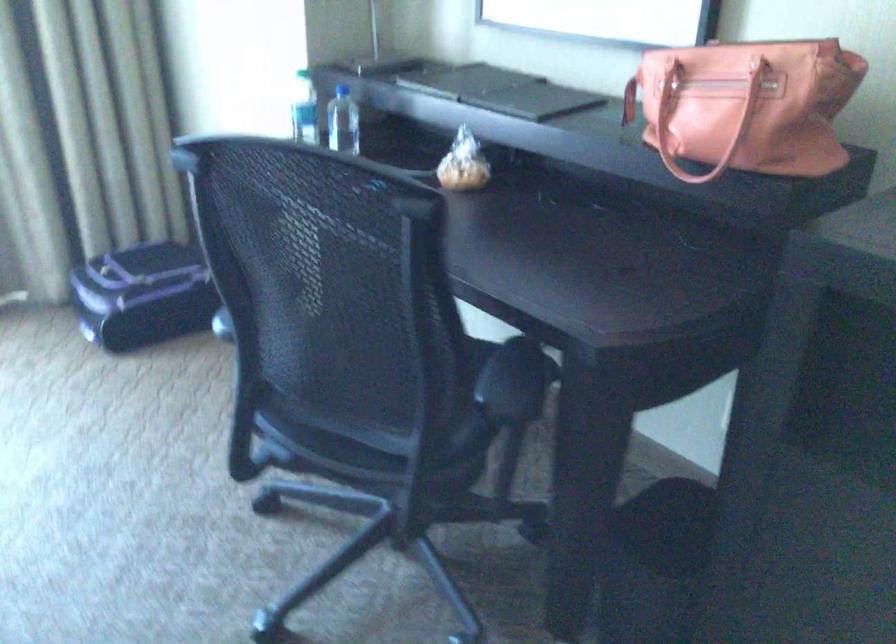
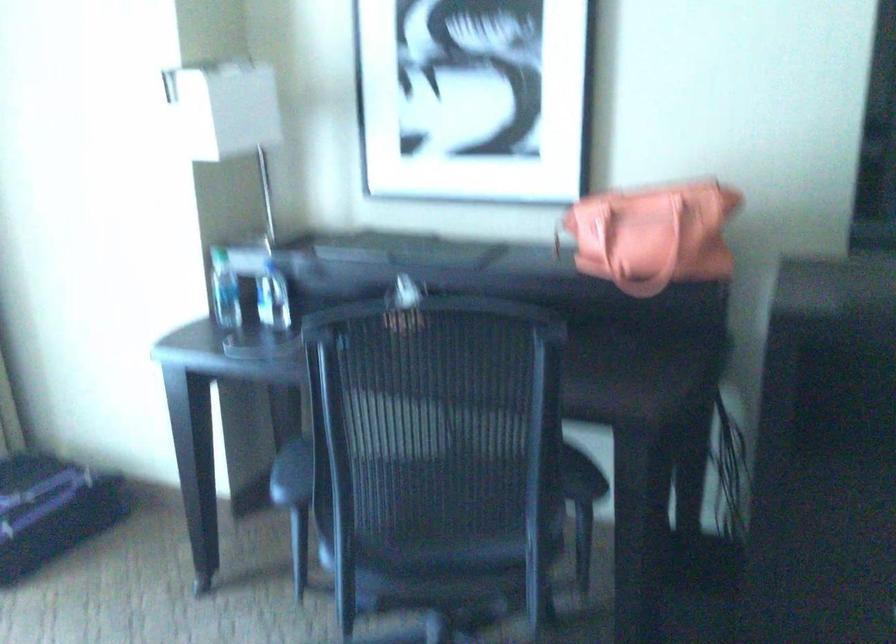
The point at (696, 116) is marked in the first image. Where is the corresponding point in the second image?

(633, 238)